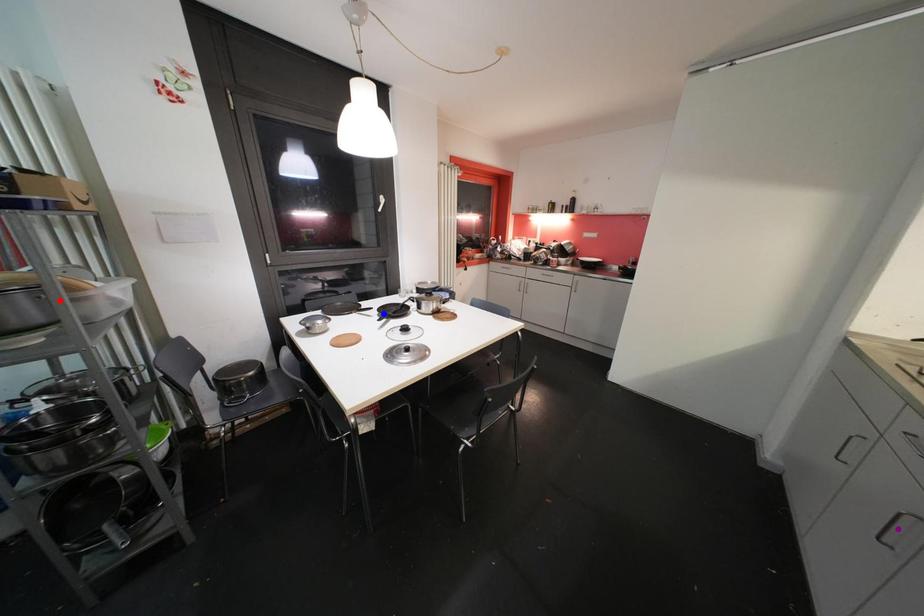
Order these from nearest to farthest:
red point
blue point
purple point

blue point < red point < purple point